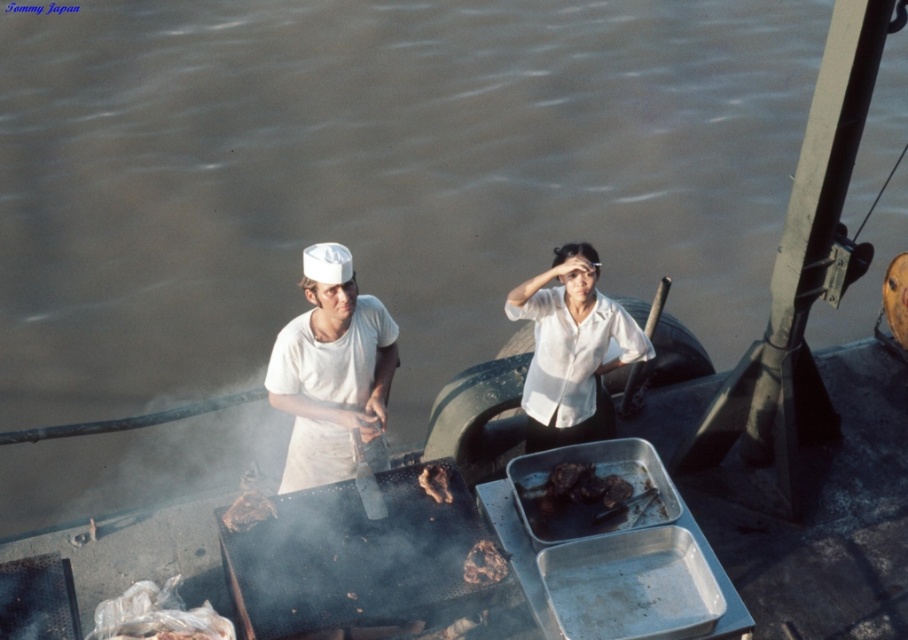
What is located at the coordinate point (247,512) in the image?

The coordinate point (247,512) corresponds to brown charred meat at center.